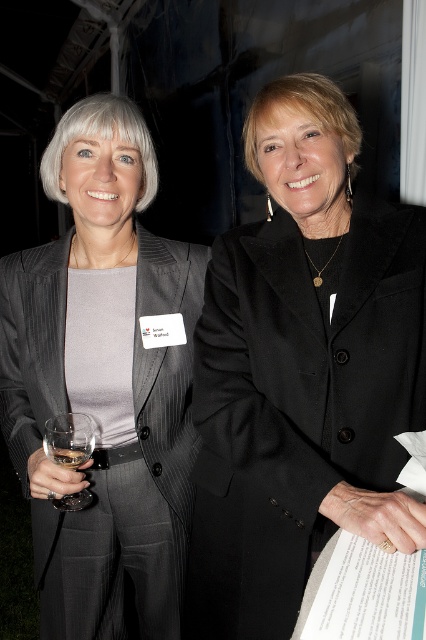
How much distance is there between black woolen blazer at right and clear glass wine at lower left?

They are 15.41 inches apart.

In the scene shown: Who is lower down, black woolen blazer at right or clear glass wine at lower left?

clear glass wine at lower left

Between point (198, 365) and point (68, 452), which one is positioned behind?

Positioned behind is point (198, 365).

Identify the location of black woolen blazer at right. (296, 403).

Looking at this image, between black woolen blazer at right and matte black suit at left, which one is positioned higher?

black woolen blazer at right is above.

Is point (313, 472) behind point (144, 266)?

No.

This screenshot has width=426, height=640. Describe the element at coordinates (296, 403) in the screenshot. I see `black woolen blazer at right` at that location.

Locate an element on the screen. The height and width of the screenshot is (640, 426). black woolen blazer at right is located at coordinates (296, 403).

Between black woolen blazer at right and clear glass wine glass at left, which one is positioned higher?

Positioned higher is black woolen blazer at right.

Between point (215, 442) and point (68, 458), which one is positioned behind?

The point (215, 442) is more distant.

Is point (232, 458) positioned after point (81, 456)?

No, it is in front of (81, 456).

What are the coordinates of `black woolen blazer at right` in the screenshot? It's located at (296, 403).